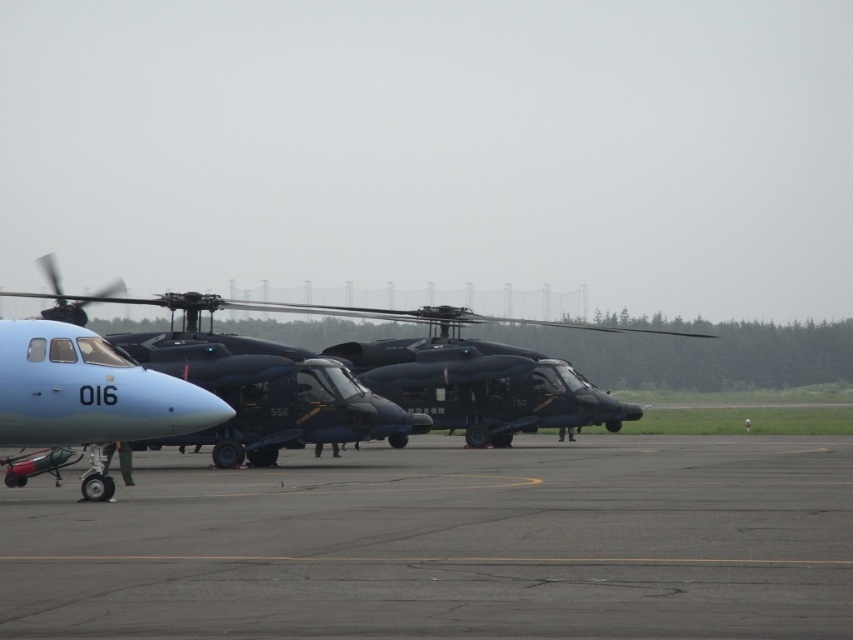
You are a pilot who needs to taxi your plane from the runway to the hangar located near the matte black helicopter at center. The matte blue airplane at lower left is blocking your path. Can you go around it by moving to the right?

The matte blue airplane at lower left is to the left of the matte black helicopter at center, so moving to the right would allow you to bypass the matte blue airplane at lower left and head towards the matte black helicopter at center.

You are a maintenance worker needing to reach the matte blue airplane at lower left from the gray asphalt tarmac at lower center. Can you walk directly to it without any obstacles?

The distance between the gray asphalt tarmac at lower center and the matte blue airplane at lower left is 8.45 feet, so you can walk directly to it without any obstacles since there is enough space.